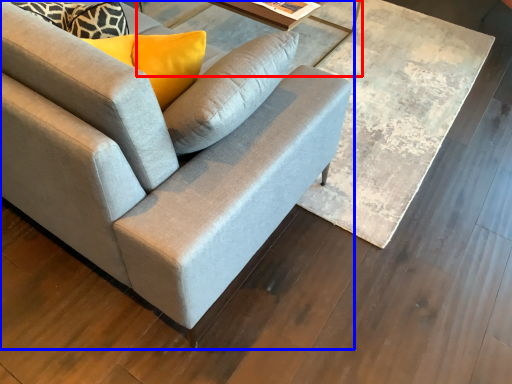
Question: Which of the following is the closest to the observer, round table (highlighted by a red box) or studio couch (highlighted by a blue box)?

Choices:
 (A) round table
 (B) studio couch

Answer: (B)